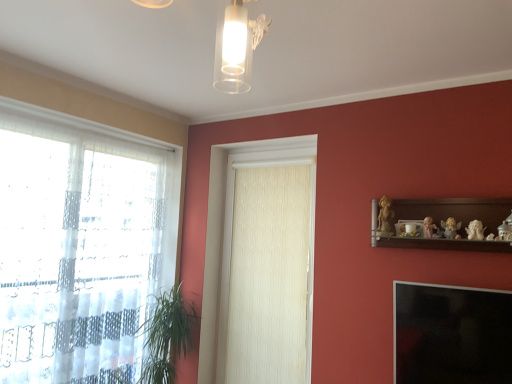
Question: Does transparent glass window screen at lower right appear on the left side of matte gold angel at upper right, the 3th toy when ordered from right to left?

Choices:
 (A) no
 (B) yes

Answer: (B)

Question: Is transparent glass window screen at lower right thinner than matte gold angel at upper right, the 3th toy when ordered from right to left?

Choices:
 (A) yes
 (B) no

Answer: (B)

Question: Does transparent glass window screen at lower right come in front of matte gold angel at upper right, the 3th toy when ordered from right to left?

Choices:
 (A) yes
 (B) no

Answer: (A)

Question: Are transparent glass window screen at lower right and matte gold angel at upper right, the 3th toy when ordered from right to left, far apart?

Choices:
 (A) yes
 (B) no

Answer: (B)

Question: Is transparent glass window screen at lower right wider than matte gold angel at upper right, which appears as the 3th toy when viewed from the left?

Choices:
 (A) no
 (B) yes

Answer: (B)

Question: Is transparent fabric at left inside or outside of wooden statue at upper right, the 5th toy when ordered from right to left?

Choices:
 (A) outside
 (B) inside

Answer: (A)

Question: Would you say transparent fabric at left is to the left or to the right of wooden statue at upper right, the 5th toy when ordered from right to left, in the picture?

Choices:
 (A) right
 (B) left

Answer: (B)

Question: Looking at the image, does transparent fabric at left seem bigger or smaller compared to wooden statue at upper right, placed as the first toy when sorted from left to right?

Choices:
 (A) big
 (B) small

Answer: (A)

Question: From the image's perspective, is transparent fabric at left positioned above or below wooden statue at upper right, placed as the first toy when sorted from left to right?

Choices:
 (A) below
 (B) above

Answer: (A)

Question: Based on their sizes in the image, would you say white porcelain figurine at upper right, positioned as the fourth toy in left-to-right order, is bigger or smaller than porcelain figurine at upper right, which is the first toy in right-to-left order?

Choices:
 (A) big
 (B) small

Answer: (B)

Question: Considering the positions of white porcelain figurine at upper right, which ranks as the second toy in right-to-left order, and porcelain figurine at upper right, which is the first toy in right-to-left order, in the image, is white porcelain figurine at upper right, which ranks as the second toy in right-to-left order, wider or thinner than porcelain figurine at upper right, which is the first toy in right-to-left order,?

Choices:
 (A) wide
 (B) thin

Answer: (A)

Question: Considering the positions of white porcelain figurine at upper right, which ranks as the second toy in right-to-left order, and porcelain figurine at upper right, arranged as the fifth toy when viewed from the left, in the image, is white porcelain figurine at upper right, which ranks as the second toy in right-to-left order, taller or shorter than porcelain figurine at upper right, arranged as the fifth toy when viewed from the left,?

Choices:
 (A) tall
 (B) short

Answer: (B)

Question: Considering the positions of point (481, 228) and point (504, 238), is point (481, 228) closer or farther from the camera than point (504, 238)?

Choices:
 (A) farther
 (B) closer

Answer: (A)

Question: Is point (5, 268) positioned closer to the camera than point (239, 306)?

Choices:
 (A) farther
 (B) closer

Answer: (B)

Question: Is transparent fabric at left situated inside white textured curtain at center or outside?

Choices:
 (A) outside
 (B) inside

Answer: (A)